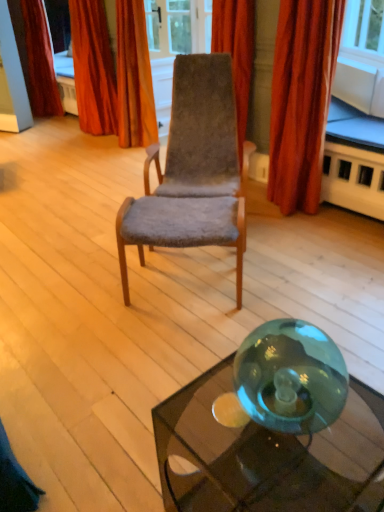
The height and width of the screenshot is (512, 384). I want to click on unoccupied area in front of velvet brown chair at center, so click(x=225, y=291).